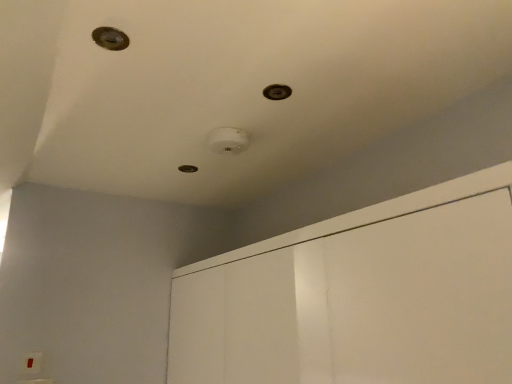
Question: In terms of width, does metallic circular hole at upper left, the first hole in the left-to-right sequence, look wider or thinner when compared to metallic circular hole at upper center, the second hole from the bottom?

Choices:
 (A) wide
 (B) thin

Answer: (A)

Question: Considering the positions of metallic circular hole at upper left, which is the third hole in back-to-front order, and metallic circular hole at upper center, which is the 2th hole in front-to-back order, in the image, is metallic circular hole at upper left, which is the third hole in back-to-front order, taller or shorter than metallic circular hole at upper center, which is the 2th hole in front-to-back order,?

Choices:
 (A) tall
 (B) short

Answer: (A)

Question: Estimate the real-world distances between objects in this image. Which object is closer to the metallic circular hole at center, the third hole from the top?

Choices:
 (A) metallic circular hole at upper center, the third hole positioned from the left
 (B) white glossy dresser at upper center
 (C) metallic circular hole at upper left, marked as the 3th hole in a right-to-left arrangement

Answer: (A)

Question: Which is farther from the metallic circular hole at center, the third hole from the top?

Choices:
 (A) metallic circular hole at upper center, the second hole from the bottom
 (B) metallic circular hole at upper left, which is the first hole in top-to-bottom order
 (C) white glossy dresser at upper center

Answer: (C)